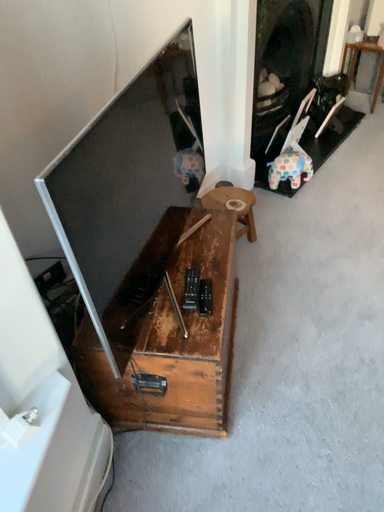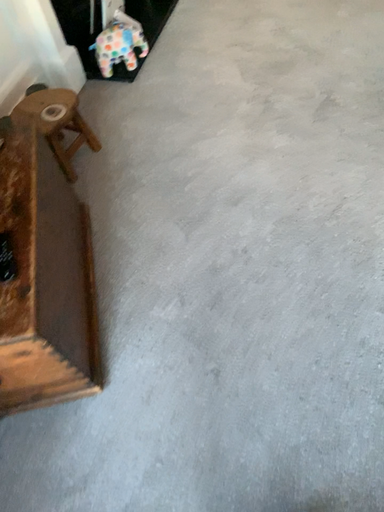
Question: How did the camera likely rotate when shooting the video?

Choices:
 (A) rotated left
 (B) rotated right

Answer: (B)